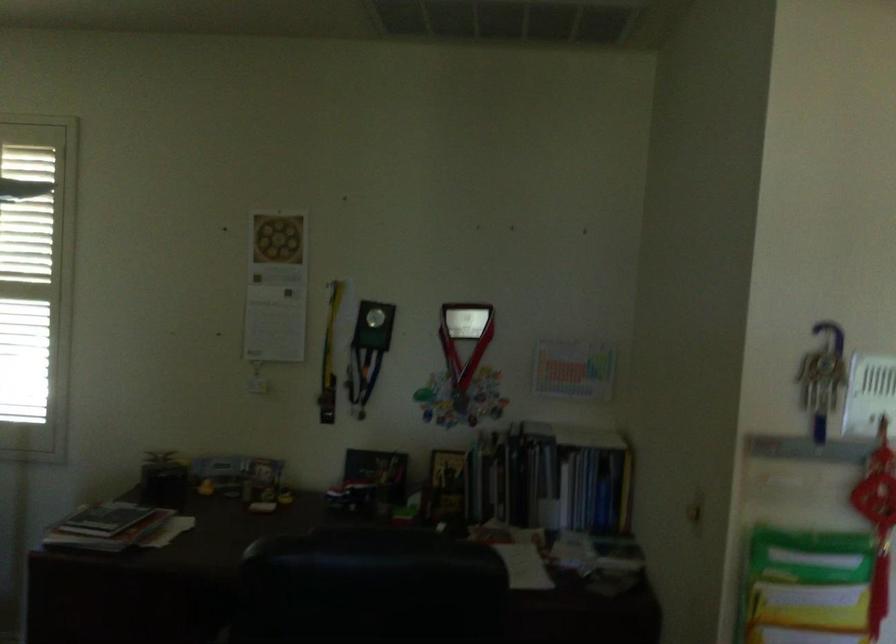
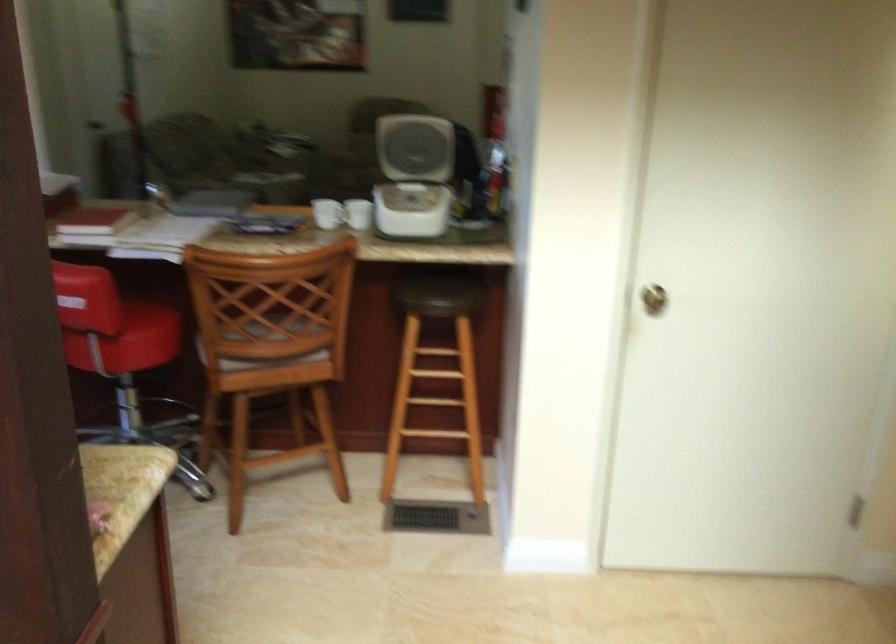
Question: I am providing you with two images of the same scene from different viewpoints. Please identify which objects are invisible in image2.

Choices:
 (A) book
 (B) green patterned plate
 (C) red book
 (D) white appliance lid

Answer: (A)